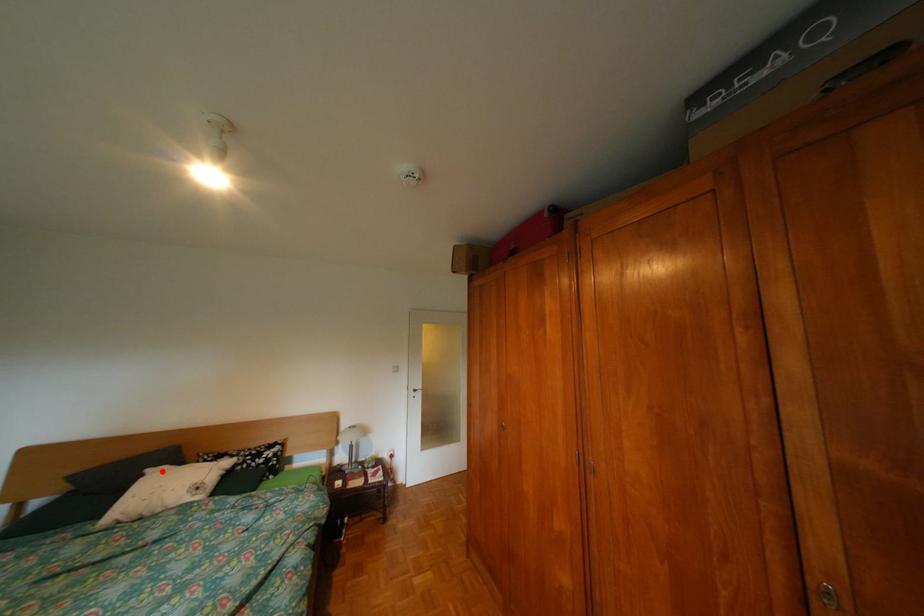
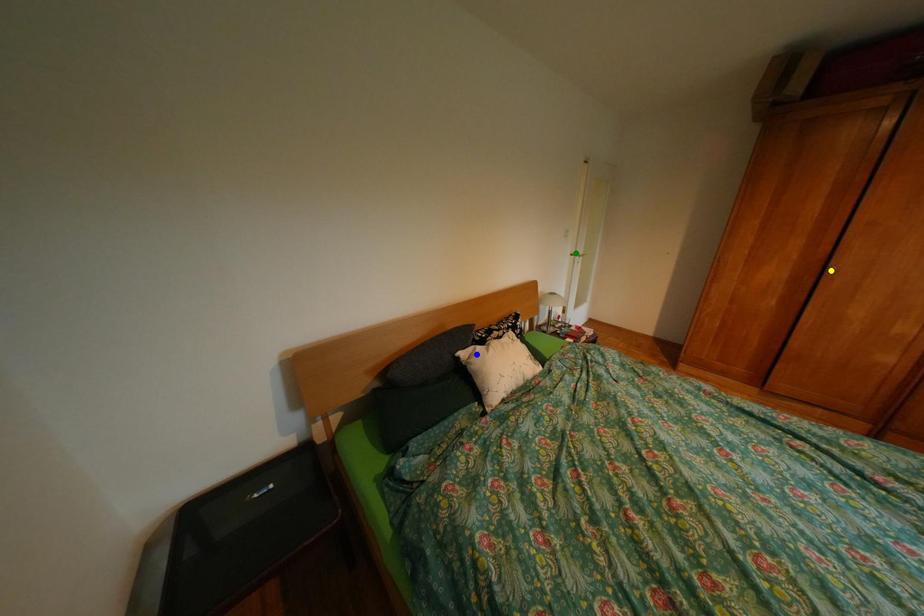
Question: I am providing you with two images of the same scene from different viewpoints. A red point is marked on the first image. You are given multiple points on the second image. Which point in image 2 represents the same 3d spot as the red point in image 1?

Choices:
 (A) green point
 (B) blue point
 (C) yellow point

Answer: (B)